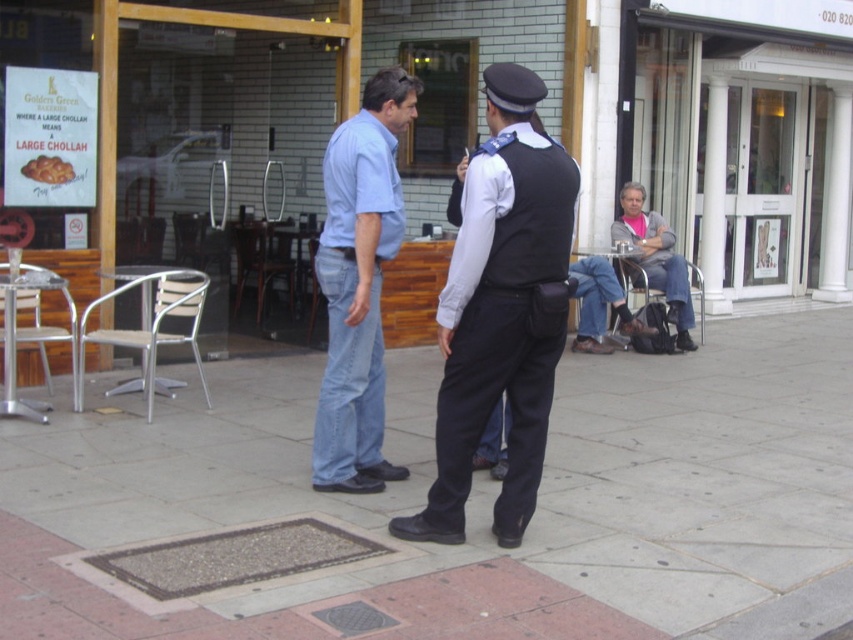
Question: Is white glass door at upper right closer to the viewer compared to dark blue fabric vest at center?

Choices:
 (A) yes
 (B) no

Answer: (B)

Question: Is smooth concrete pavement at center bigger than gray sweater at right?

Choices:
 (A) yes
 (B) no

Answer: (B)

Question: Among these objects, which one is nearest to the camera?

Choices:
 (A) dark blue fabric vest at center
 (B) smooth concrete pavement at center

Answer: (A)

Question: Can you confirm if white glass door at upper right is positioned below gray sweater at right?

Choices:
 (A) yes
 (B) no

Answer: (B)

Question: Which object appears farthest from the camera in this image?

Choices:
 (A) light blue denim jeans at center
 (B) dark blue fabric vest at center

Answer: (A)

Question: Among these objects, which one is farthest from the camera?

Choices:
 (A) smooth concrete pavement at center
 (B) dark blue fabric vest at center
 (C) white glass door at upper right
 (D) light blue denim jeans at center

Answer: (C)